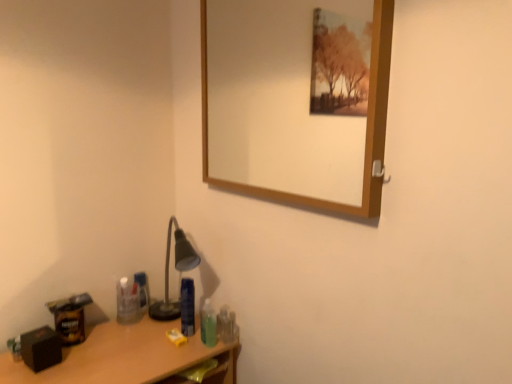
You are a GUI agent. You are given a task and a screenshot of the screen. Output one action in this format:
    pyautogui.click(x=<x>, y=<y>)
    Task: Click on the vacant space situated on the left part of blue plastic bottle at lower center, the 2th toiletry when ordered from back to front
    Image resolution: width=512 pixels, height=384 pixels.
    Given the screenshot: What is the action you would take?
    pyautogui.click(x=145, y=331)